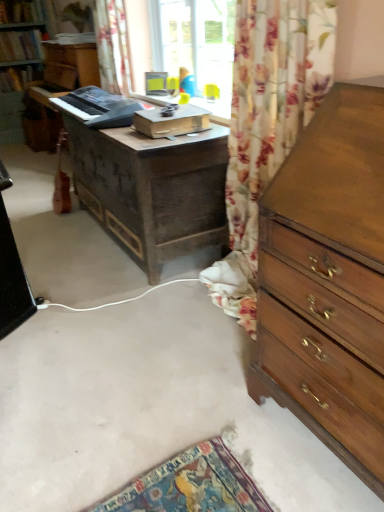
Question: Would you say dark brown wooden desk at center is to the left or to the right of black plastic keyboard at center in the picture?

Choices:
 (A) left
 (B) right

Answer: (B)

Question: From a real-world perspective, is dark brown wooden desk at center physically located above or below black plastic keyboard at center?

Choices:
 (A) below
 (B) above

Answer: (A)

Question: Estimate the real-world distances between objects in this image. Which object is farther from the dark brown wooden desk at center?

Choices:
 (A) black plastic keyboard at center
 (B) wooden chest of drawers at right
 (C) floral fabric curtain at upper center

Answer: (B)

Question: Estimate the real-world distances between objects in this image. Which object is closer to the floral fabric curtain at upper center?

Choices:
 (A) black plastic keyboard at center
 (B) dark brown wooden desk at center
 (C) wooden chest of drawers at right

Answer: (A)